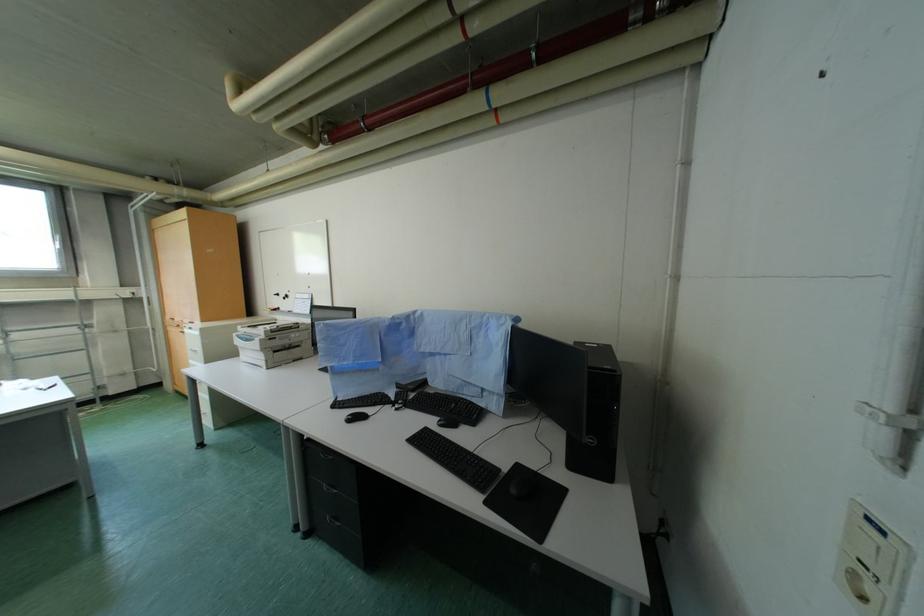
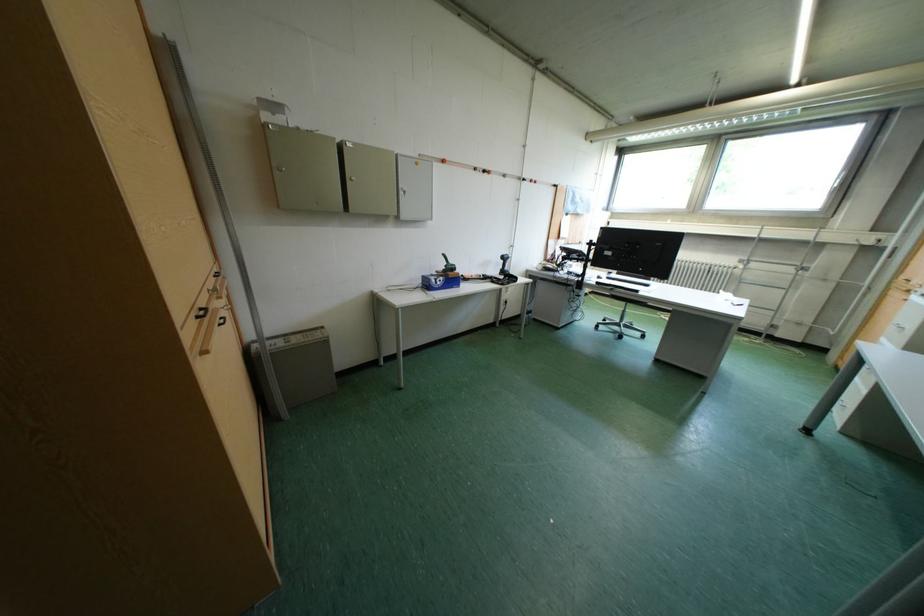
The first image is from the beginning of the video and the second image is from the end. How did the camera likely rotate when shooting the video?

The camera rotated toward left-down.